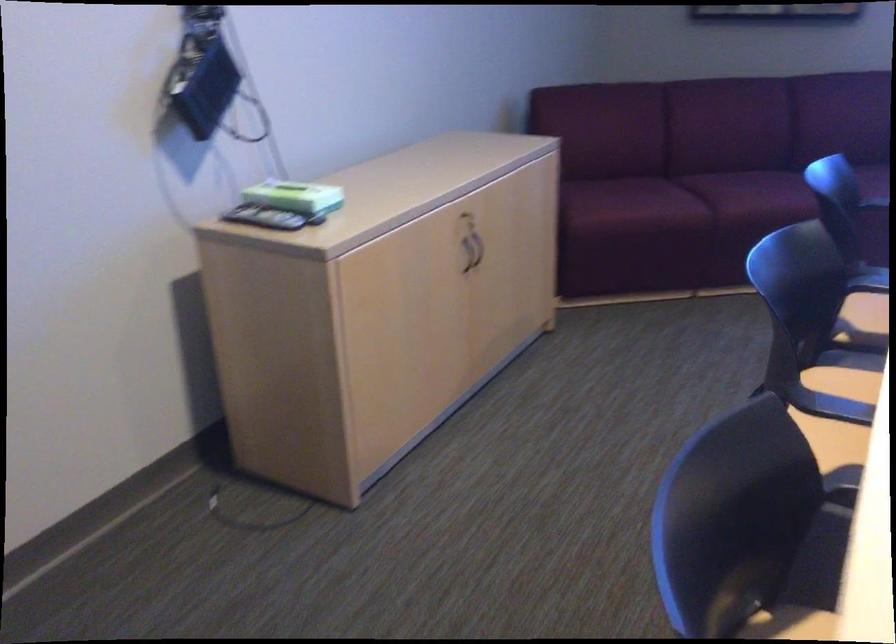
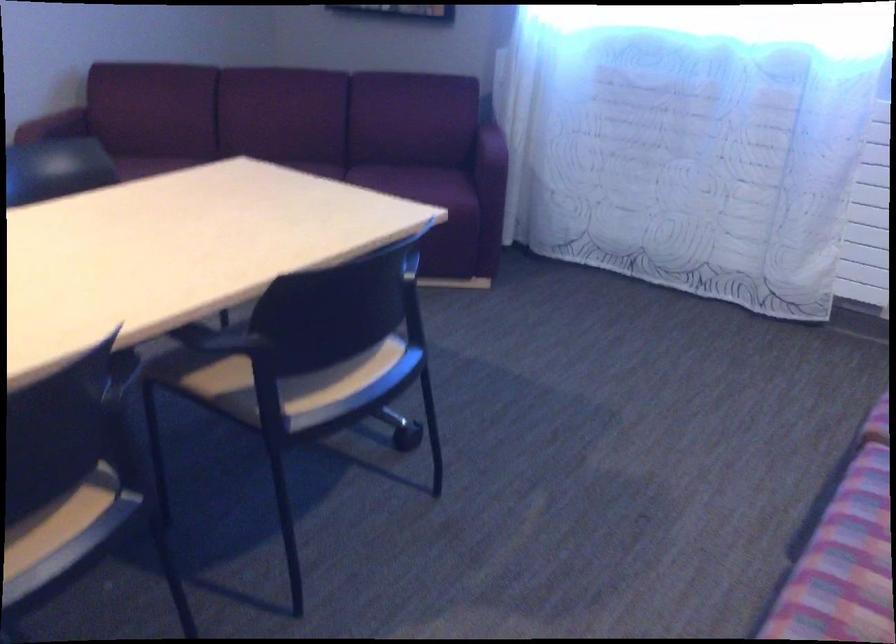
Question: I am providing you with two images of the same scene from different viewpoints. Please identify which objects are invisible in image2.

Choices:
 (A) chair sitting surface
 (B) sofa armrest
 (C) pink striped pillow
 (D) sofa sitting surface

Answer: (D)